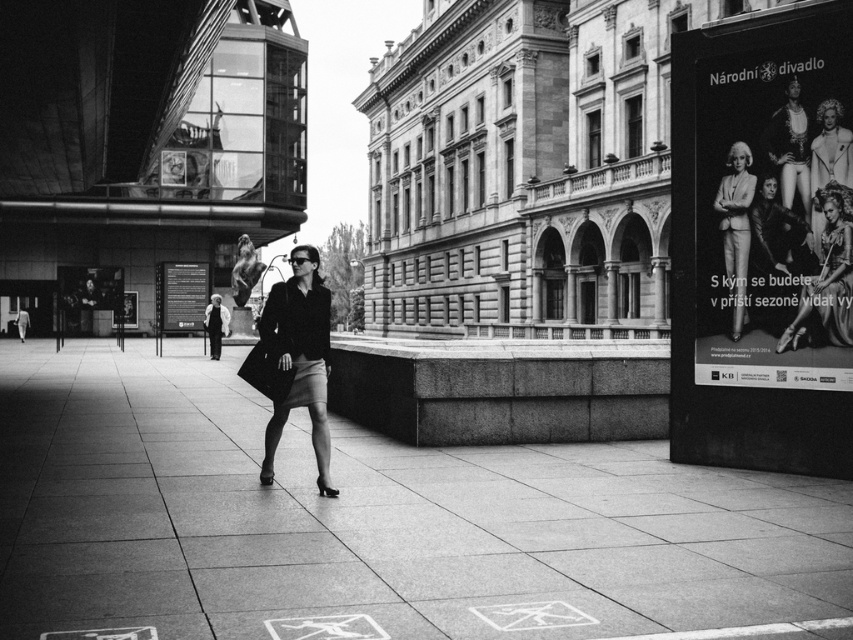
You are an artist trying to sketch the scene. You notice the smooth paper poster at right and the matte black suit at center. Which object should you draw first if you want to capture the larger one first?

The smooth paper poster at right is bigger than the matte black suit at center, so you should draw the smooth paper poster at right first.

You are a photographer trying to capture the woman in the image. You notice the matte black coat at center and the matte black dress at center. Which one is closer to the camera?

The matte black coat at center is in front of the matte black dress at center, so the coat is closer to the camera.

You are a photographer trying to capture the entire scene in one shot. Given that the smooth concrete pavement at center and the matte black dress at center are both in the frame, which object would occupy more of the image area?

The smooth concrete pavement at center occupies more of the image area because it is larger in size than the matte black dress at center.